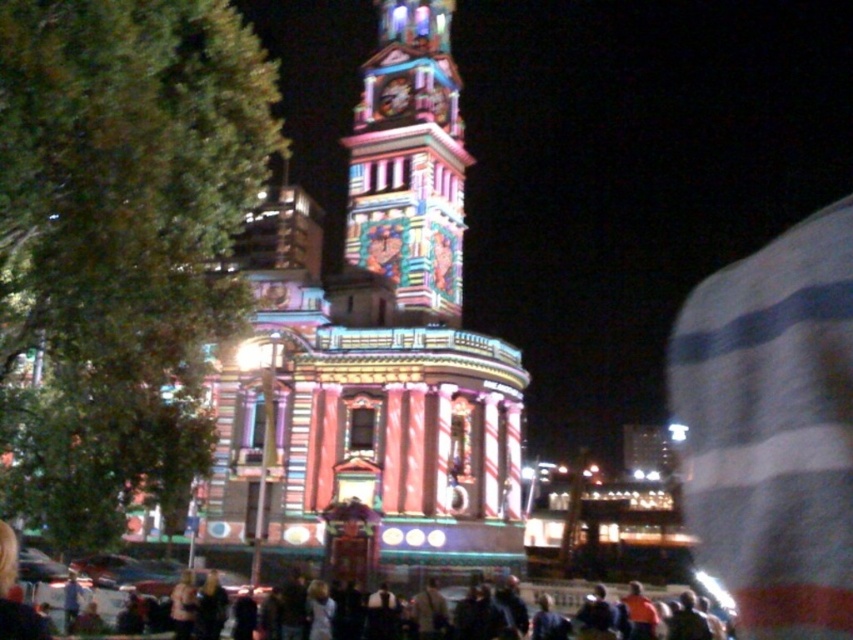
You are standing in the crowd in front of the building. You want to take a photo of the multicolored illuminated tower at center. Where should you position yourself relative to the point marked by coordinates point (x=373, y=349) to ensure the tower is fully captured in your photo?

You should position yourself at the point marked by coordinates point (x=373, y=349) because that point represents the multicolored illuminated tower at center, ensuring the tower is centered in your photo.

You are a photographer trying to capture the multicolored illuminated tower at center and the dark clothing crowd at center in a single shot. Given that the tower is larger in the image, which object will appear more prominent in the final photo?

The multicolored illuminated tower at center will appear more prominent in the photo because it has a larger size compared to the dark clothing crowd at center.

You are standing in front of the illuminated building and want to determine the distance between two points marked in the scene. The first point is located at coordinates point (367,253) and the second at point (44,579). Given that the first point is closer to you than the second, can you estimate which point is nearer to your current position?

Point (367,253) is further to the viewer than point (44,579). Wait, the description says the first point is further, but the question states the first is closer. There is a contradiction here. Let me check again. The Objects Description says point (367,253) is further than (44,579). So the answer should clarify that despite the coordinates, according to the description, point 0.397 is further away. Hmm, maybe the question is phrased incorrectly. The user might have made a mistake in the query.